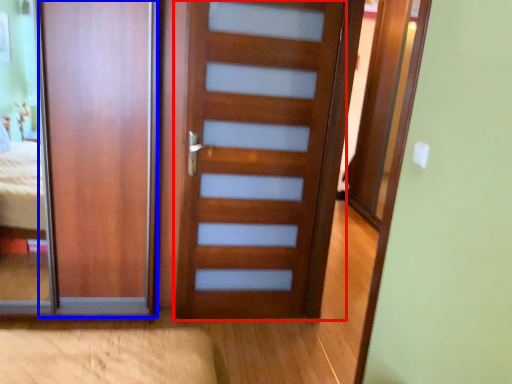
Question: Which point is closer to the camera, door (highlighted by a red box) or door (highlighted by a blue box)?

Choices:
 (A) door
 (B) door

Answer: (A)